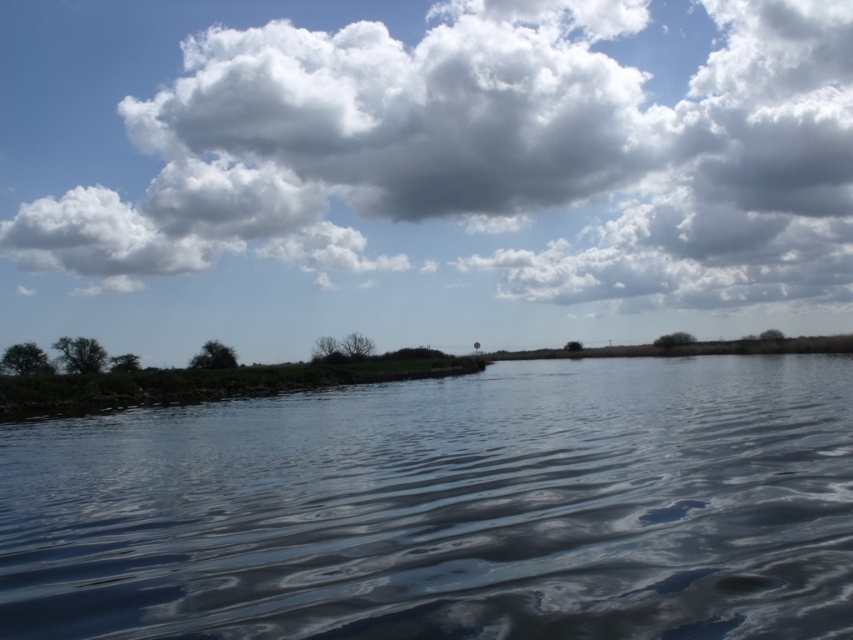
Question: Which point is farther from the camera taking this photo?

Choices:
 (A) (583, 456)
 (B) (581, 232)

Answer: (B)

Question: Can you confirm if glossy water at center is thinner than white fluffy cloud at upper center?

Choices:
 (A) no
 (B) yes

Answer: (B)

Question: Is glossy water at center thinner than white fluffy cloud at upper center?

Choices:
 (A) no
 (B) yes

Answer: (B)

Question: Which object appears farthest from the camera in this image?

Choices:
 (A) white fluffy cloud at upper center
 (B) glossy water at center

Answer: (A)

Question: Is glossy water at center bigger than white fluffy cloud at upper center?

Choices:
 (A) no
 (B) yes

Answer: (A)

Question: Among these objects, which one is farthest from the camera?

Choices:
 (A) glossy water at center
 (B) white fluffy cloud at upper center

Answer: (B)